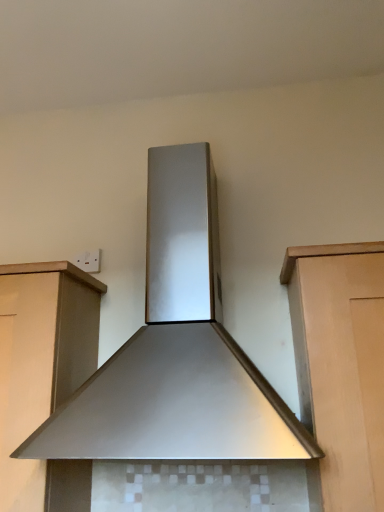
Question: Is stainless steel range hood at center taller or shorter than matte wood cabinet at left?

Choices:
 (A) tall
 (B) short

Answer: (A)

Question: Based on their sizes in the image, would you say stainless steel range hood at center is bigger or smaller than matte wood cabinet at left?

Choices:
 (A) small
 (B) big

Answer: (B)

Question: Is stainless steel range hood at center to the left or to the right of matte wood cabinet at left in the image?

Choices:
 (A) left
 (B) right

Answer: (B)

Question: Looking at their shapes, would you say matte wood cabinet at left is wider or thinner than stainless steel range hood at center?

Choices:
 (A) wide
 (B) thin

Answer: (B)

Question: Is matte wood cabinet at left in front of or behind stainless steel range hood at center in the image?

Choices:
 (A) front
 (B) behind

Answer: (B)

Question: Considering the positions of matte wood cabinet at left and stainless steel range hood at center in the image, is matte wood cabinet at left bigger or smaller than stainless steel range hood at center?

Choices:
 (A) small
 (B) big

Answer: (A)

Question: Is matte wood cabinet at left taller or shorter than stainless steel range hood at center?

Choices:
 (A) tall
 (B) short

Answer: (B)